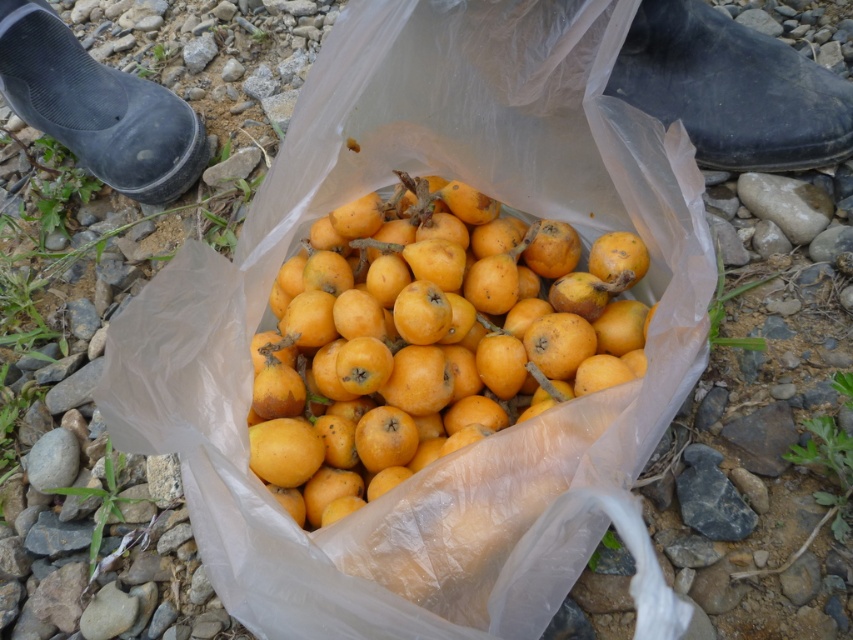
Who is taller, orange matte fruit at center or black rubber boot at upper left?

orange matte fruit at center

Which is more to the right, orange matte fruit at center or black rubber boot at upper left?

From the viewer's perspective, orange matte fruit at center appears more on the right side.

Where is `orange matte fruit at center`? Image resolution: width=853 pixels, height=640 pixels. orange matte fruit at center is located at coordinates 427,339.

Locate an element on the screen. Image resolution: width=853 pixels, height=640 pixels. orange matte fruit at center is located at coordinates (427, 339).